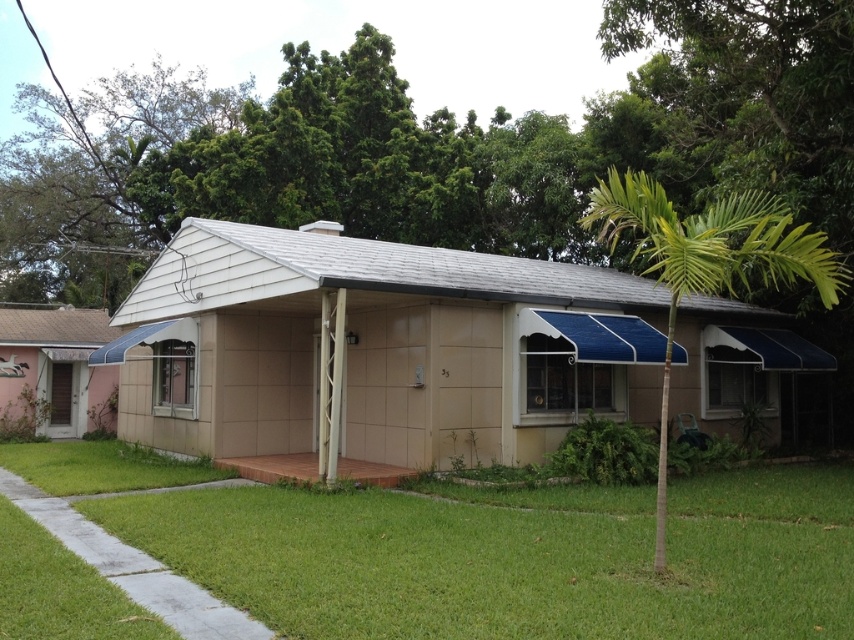
Question: Which object is closer to the camera taking this photo?

Choices:
 (A) green grass at lower center
 (B) beige tile shed at center

Answer: (A)

Question: Which point is closer to the camera?

Choices:
 (A) (776, 484)
 (B) (294, 326)

Answer: (A)

Question: Is beige tile shed at center positioned behind green grass at lower center?

Choices:
 (A) no
 (B) yes

Answer: (B)

Question: Is beige tile shed at center to the left of green grass at lower center from the viewer's perspective?

Choices:
 (A) yes
 (B) no

Answer: (B)

Question: Considering the relative positions of beige tile shed at center and green grass at lower center in the image provided, where is beige tile shed at center located with respect to green grass at lower center?

Choices:
 (A) left
 (B) right

Answer: (B)